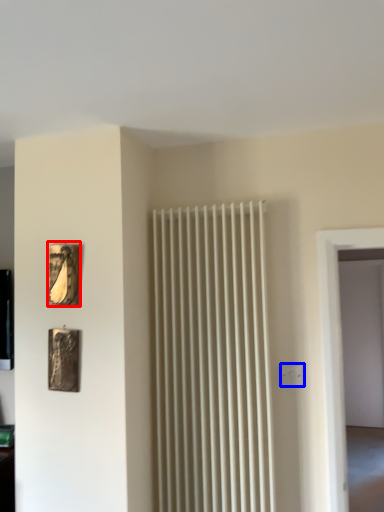
Question: Which object appears farthest to the camera in this image, picture frame (highlighted by a red box) or electric outlet (highlighted by a blue box)?

Choices:
 (A) picture frame
 (B) electric outlet

Answer: (B)